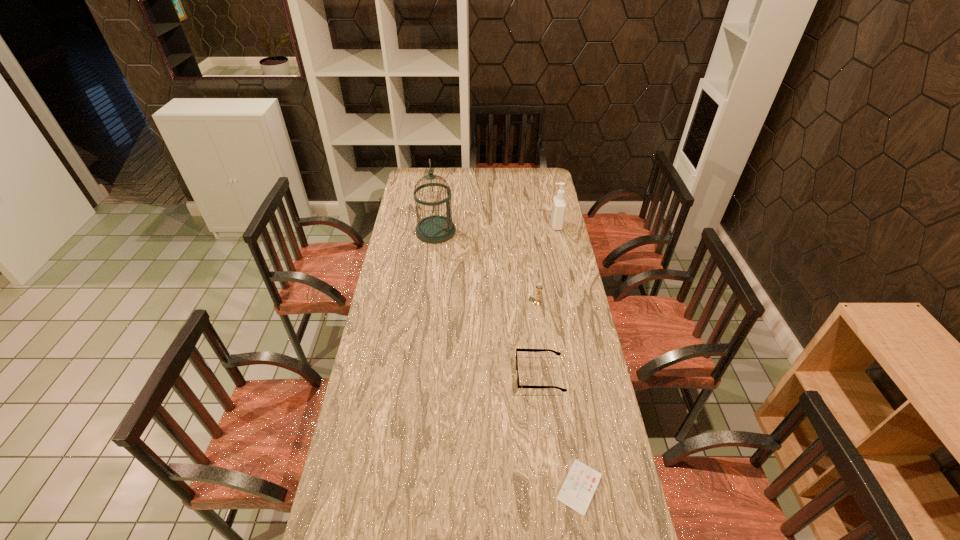
At what (x,y) coordinates should I click in order to perform the action: click on spectacles at the right edge. Please return your answer as a coordinate pair (x, y). This screenshot has height=540, width=960. Looking at the image, I should click on (517, 349).

Find the location of a particular element. The height and width of the screenshot is (540, 960). diary located at the right edge is located at coordinates (581, 482).

This screenshot has width=960, height=540. In the image, there is a desktop. What are the coordinates of `vacant space at the far edge` in the screenshot? It's located at (463, 186).

This screenshot has width=960, height=540. In the image, there is a desktop. In order to click on vacant space at the left edge in this screenshot , I will do `click(422, 258)`.

Locate an element on the screen. The height and width of the screenshot is (540, 960). vacant space at the right edge of the desktop is located at coordinates (549, 197).

Find the location of a particular element. The width and height of the screenshot is (960, 540). vacant space at the far right corner of the desktop is located at coordinates (536, 168).

This screenshot has height=540, width=960. Identify the location of free point between the third shortest object and the leftmost object. (487, 267).

Find the location of a particular element. This screenshot has width=960, height=540. empty location between the fourth tallest object and the shortest object is located at coordinates (560, 431).

The image size is (960, 540). Find the location of `vacant region between the cleansing agent and the spectacles`. vacant region between the cleansing agent and the spectacles is located at coordinates 548,300.

This screenshot has width=960, height=540. I want to click on vacant area between the cleansing agent and the leftmost object, so click(495, 228).